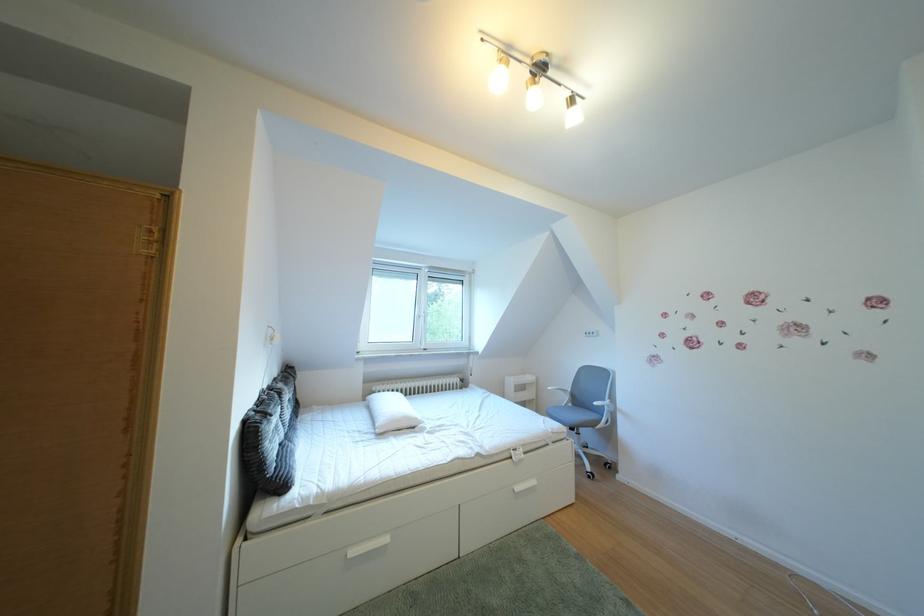
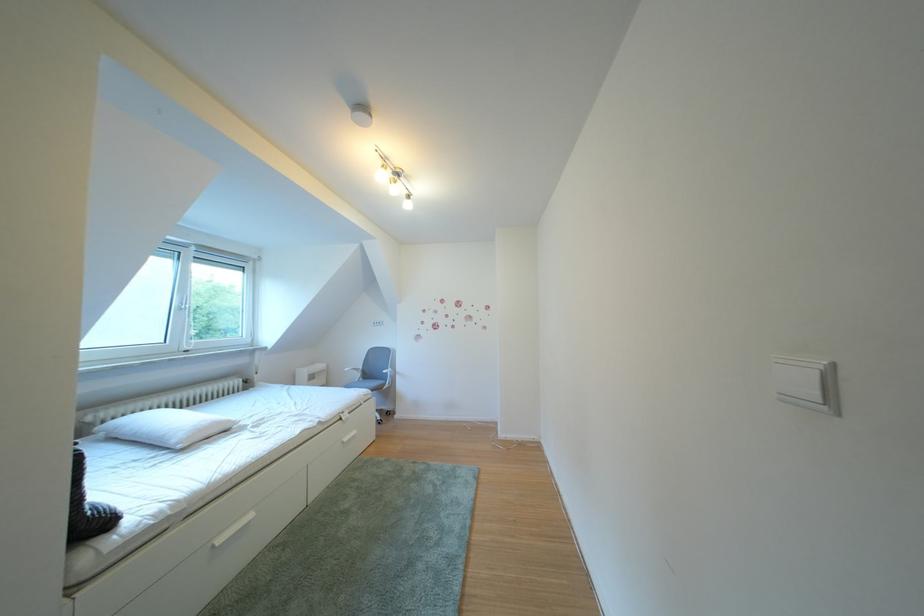
Find the pixel in the second image that matches (387,394) in the first image.

(103, 424)